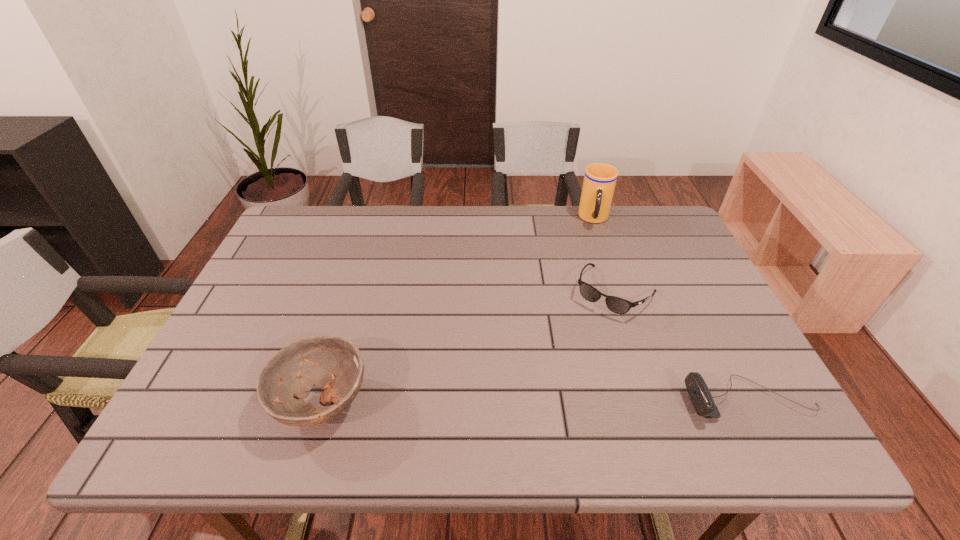
Where is `sunglasses situated at the right edge`? This screenshot has width=960, height=540. sunglasses situated at the right edge is located at coordinates (615, 304).

You are a GUI agent. You are given a task and a screenshot of the screen. Output one action in this format:
    pyautogui.click(x=<x>, y=<y>)
    Task: Click on the object located at the near right corner
    
    Given the screenshot: What is the action you would take?
    pyautogui.click(x=698, y=391)

In the image, there is a desktop. In order to click on vacant space at the far edge in this screenshot , I will do `click(503, 237)`.

Identify the location of vacant space at the near edge of the desktop. (546, 402).

In order to click on free space at the right edge of the desktop in this screenshot , I will do click(x=646, y=274).

This screenshot has height=540, width=960. I want to click on free region at the near left corner, so click(254, 400).

This screenshot has height=540, width=960. Identify the location of vacant position at the far right corner of the desktop. (639, 250).

This screenshot has width=960, height=540. Identify the location of free space between the webcam and the tallest object. (672, 309).

I want to click on empty location between the bowl and the third nearest object, so click(468, 347).

At what (x,y) coordinates should I click in order to perform the action: click on vacant region between the bowl and the tallest object. Please return your answer as a coordinate pair (x, y). The width and height of the screenshot is (960, 540). Looking at the image, I should click on (458, 310).